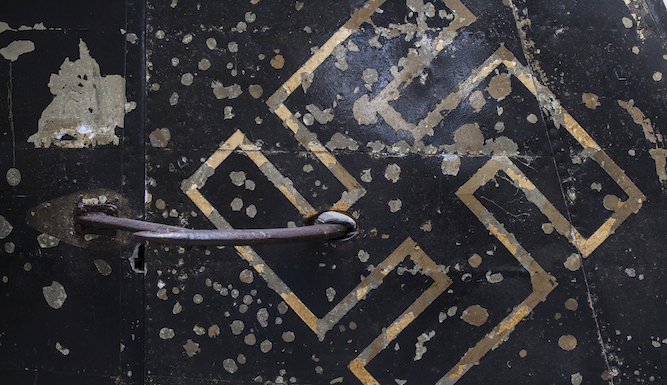
Where is `wall`? wall is located at coordinates (79, 125), (57, 309).